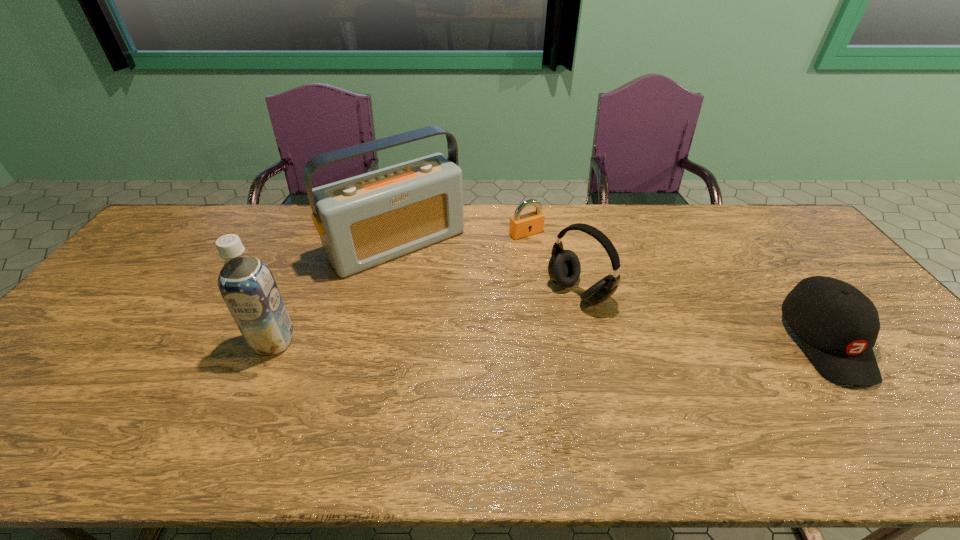
Find the location of a particular element. Image resolution: width=960 pixels, height=540 pixels. free space located 0.260m on the ear cups of the headset is located at coordinates (491, 359).

The image size is (960, 540). Identify the location of free space located 0.350m on the ear cups of the headset. pyautogui.click(x=463, y=379).

Image resolution: width=960 pixels, height=540 pixels. I want to click on free location located to unlock the padlock from the front, so click(599, 308).

At what (x,y) coordinates should I click in order to perform the action: click on vacant position located 0.060m to unlock the padlock from the front. Please return your answer as a coordinate pair (x, y). This screenshot has height=540, width=960. Looking at the image, I should click on (544, 250).

This screenshot has width=960, height=540. I want to click on free point located 0.220m to unlock the padlock from the front, so click(573, 280).

In order to click on radio receiver present at the far edge in this screenshot , I will do `click(363, 221)`.

Where is `padlock present at the far edge`? padlock present at the far edge is located at coordinates (530, 223).

Locate an element on the screen. The height and width of the screenshot is (540, 960). object that is at the near edge is located at coordinates (838, 326).

This screenshot has width=960, height=540. Find the location of `object present at the right edge`. object present at the right edge is located at coordinates (838, 326).

Where is `object that is at the near right corner`? object that is at the near right corner is located at coordinates (838, 326).